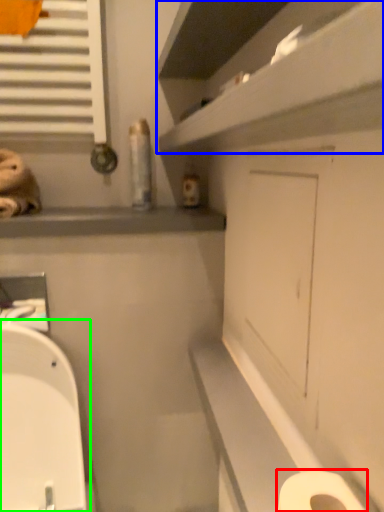
Question: Estimate the real-world distances between objects in this image. Which object is farther from toilet paper (highlighted by a red box), shelf (highlighted by a blue box) or toilet (highlighted by a green box)?

Choices:
 (A) shelf
 (B) toilet

Answer: (B)